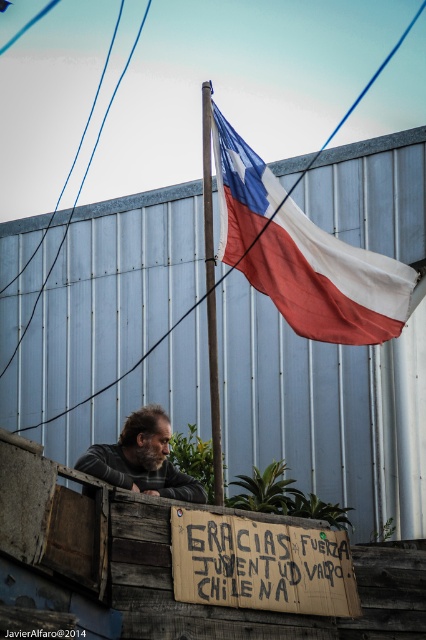
Between point (403, 298) and point (238, 516), which one is positioned behind?

Point (403, 298)

What do you see at coordinates (302, 253) in the screenshot? I see `red-white-blue fabric flag at upper center` at bounding box center [302, 253].

Image resolution: width=426 pixels, height=640 pixels. Find the location of `red-white-blue fabric flag at upper center`. red-white-blue fabric flag at upper center is located at coordinates (x=302, y=253).

Is point (262, 204) closer to viewer compared to point (123, 467)?

No, it is not.

Measure the distance from red-white-blue fabric flag at upper center to gray fabric shirt at lower left.

14.92 feet

Is point (321, 310) more distant than point (89, 467)?

That is True.

Locate an element on the screen. The image size is (426, 640). red-white-blue fabric flag at upper center is located at coordinates (302, 253).

Which is above, red-white-blue fabric flag at upper center or wooden pole at upper center?

wooden pole at upper center

Is red-white-blue fabric flag at upper center bigger than wooden pole at upper center?

No, red-white-blue fabric flag at upper center is not bigger than wooden pole at upper center.

Is point (238, 212) in front of point (213, 467)?

Yes, point (238, 212) is in front of point (213, 467).

Identify the location of red-white-blue fabric flag at upper center. This screenshot has height=640, width=426. (302, 253).